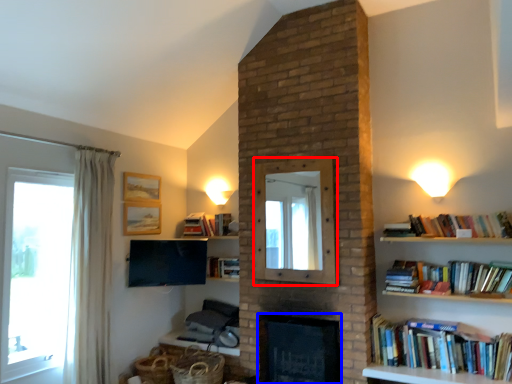
Question: Which object appears farthest to the camera in this image, mirror (highlighted by a red box) or fireplace (highlighted by a blue box)?

Choices:
 (A) mirror
 (B) fireplace

Answer: (A)